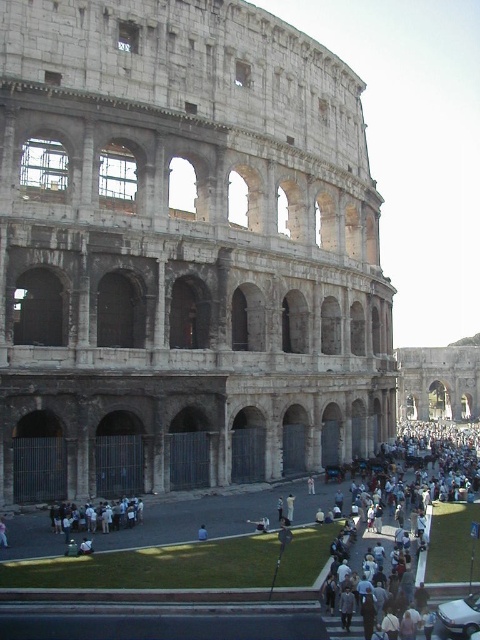
You are standing at the Colosseum and want to take a photo of the structure. You have two points marked on your camera screen to frame the shot. The first point is at coordinates point (216,326) and the second is at point (204,528). Which point is closer to the Colosseum?

Point (204,528) is closer to the Colosseum because point (216,326) is behind it.